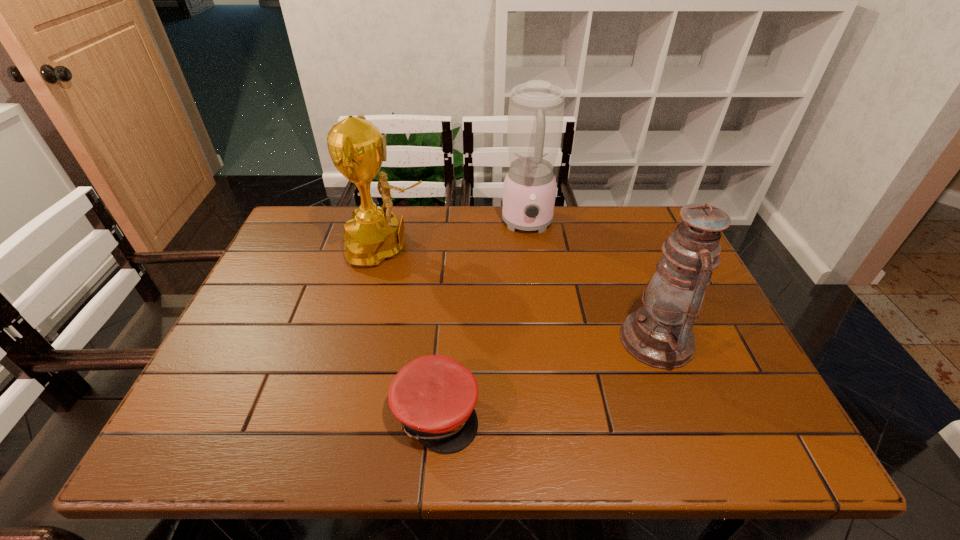
The width and height of the screenshot is (960, 540). Identify the location of free spot that satisfies the following two spatial constraints: 1. on the front side of the award; 2. on the right side of the rightmost object. (364, 340).

Image resolution: width=960 pixels, height=540 pixels. In order to click on free space that satisfies the following two spatial constraints: 1. on the base of the third object from left to right near the control knob; 2. on the front side of the award in this screenshot , I will do `click(531, 247)`.

Identify the location of free space in the image that satisfies the following two spatial constraints: 1. on the base of the food processor near the control knob; 2. at the front of the cap where the visor is located. (554, 413).

I want to click on blank space that satisfies the following two spatial constraints: 1. on the base of the second object from right to left near the control knob; 2. at the front of the shortest object where the visor is located, so click(x=554, y=413).

At what (x,y) coordinates should I click in order to perform the action: click on free spot that satisfies the following two spatial constraints: 1. on the front side of the award; 2. on the back side of the rightmost object. Please return your answer as a coordinate pair (x, y). This screenshot has width=960, height=540. Looking at the image, I should click on (364, 340).

You are a GUI agent. You are given a task and a screenshot of the screen. Output one action in this format:
    pyautogui.click(x=<x>, y=<y>)
    Task: Click on the vacant region that satisfies the following two spatial constraints: 1. on the front side of the award; 2. on the right side of the oil lamp
    This screenshot has width=960, height=540.
    Given the screenshot: What is the action you would take?
    pyautogui.click(x=364, y=340)

You are a GUI agent. You are given a task and a screenshot of the screen. Output one action in this format:
    pyautogui.click(x=<x>, y=<y>)
    Task: Click on the vacant space that satisfies the following two spatial constraints: 1. on the front side of the rightmost object; 2. on the left side of the award
    
    Given the screenshot: What is the action you would take?
    pyautogui.click(x=364, y=340)

I want to click on free space in the image that satisfies the following two spatial constraints: 1. on the front side of the oil lamp; 2. at the front of the cap where the visor is located, so click(684, 413).